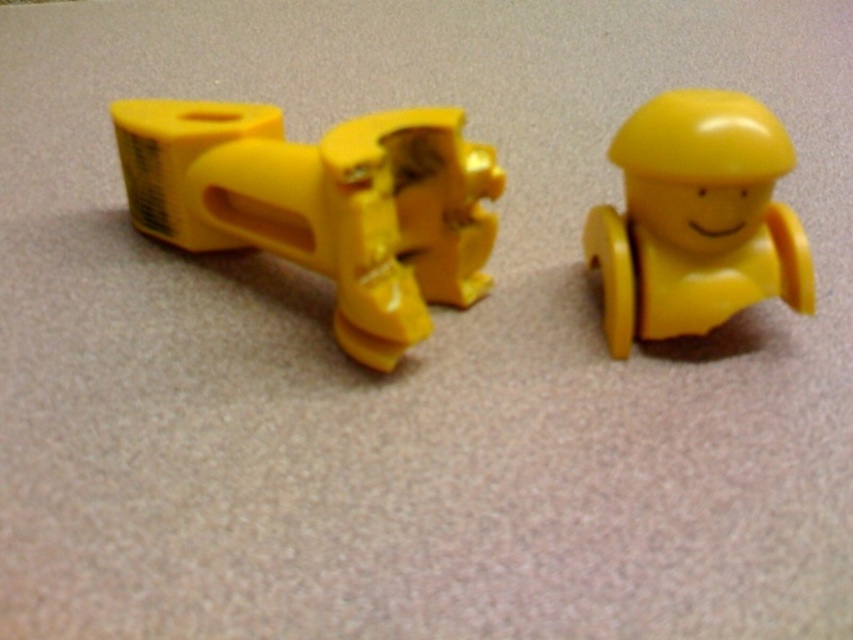
Question: Among these objects, which one is nearest to the camera?

Choices:
 (A) yellow matte toy at right
 (B) matte yellow toy at left

Answer: (B)

Question: Is matte yellow toy at left to the left of yellow matte toy at right from the viewer's perspective?

Choices:
 (A) yes
 (B) no

Answer: (A)

Question: Which object appears farthest from the camera in this image?

Choices:
 (A) yellow matte toy at right
 (B) matte yellow toy at left

Answer: (A)

Question: Can you confirm if matte yellow toy at left is positioned below yellow matte toy at right?

Choices:
 (A) no
 (B) yes

Answer: (A)

Question: In this image, where is matte yellow toy at left located relative to yellow matte toy at right?

Choices:
 (A) left
 (B) right

Answer: (A)